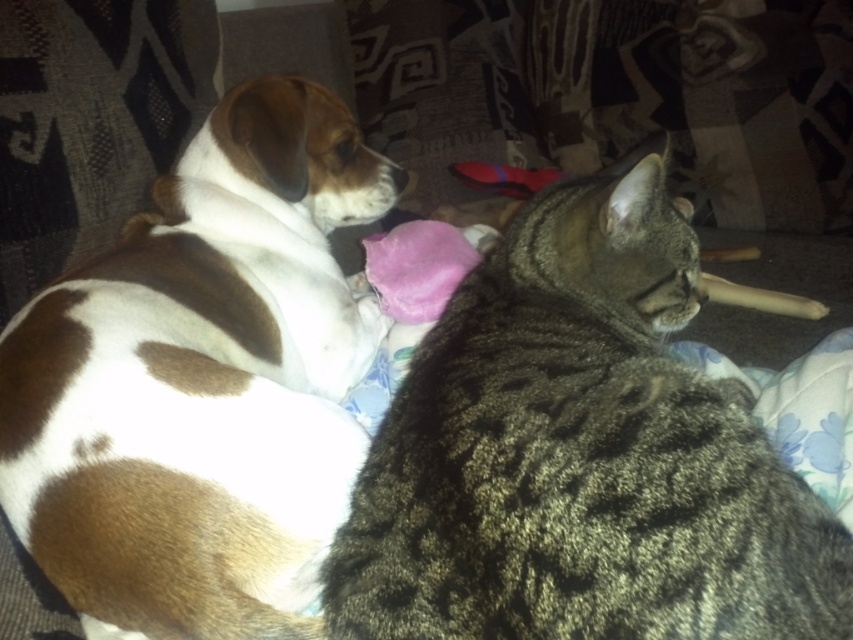
You are a photographer trying to take a photo of the tabby fur cat at center and the brown and white fur dog at left. If you move your camera slightly forward, which animal will appear closer to the front of the photo?

The tabby fur cat at center is in front of the brown and white fur dog at left, so moving the camera forward will make the tabby fur cat at center appear closer to the front of the photo.

You are holding a camera 25.49 inches away from the tabby fur cat at center. If you want to take a photo of the cat without moving the camera, will the dog also be in the frame?

The tabby fur cat at center and camera are 25.49 inches apart. Since the dog is positioned on the left side of the frame and the cat is at the center, the dog would also be within the camera frame as they are both resting on the same couch together.

You are a pet sitter trying to place a divider between the tabby fur cat at center and the brown and white fur dog at left. Based on their widths, will the divider fit if it requires at least 10cm of space between them?

The tabby fur cat at center might be wider than brown and white fur dog at left, so the divider may not fit properly if the required space is 10cm. Check their actual widths before placing the divider.